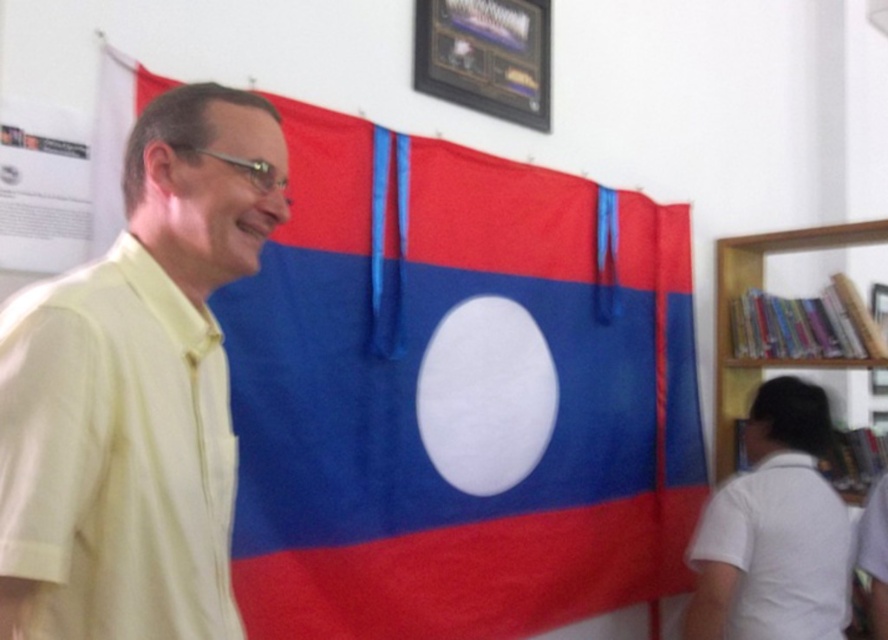
Question: Among these objects, which one is farthest from the camera?

Choices:
 (A) yellow cotton shirt at left
 (B) white matte shirt at lower right
 (C) wooden bookshelf at right
 (D) textured fabric flag at center

Answer: (C)

Question: Is yellow cotton shirt at left below metallic framed certificate at upper center?

Choices:
 (A) yes
 (B) no

Answer: (A)

Question: Can you confirm if yellow cotton shirt at left is positioned above white matte shirt at lower right?

Choices:
 (A) no
 (B) yes

Answer: (B)

Question: Which point is closer to the camera?

Choices:
 (A) (735, 476)
 (B) (437, 8)
 (C) (239, 208)
 (D) (722, 305)

Answer: (C)

Question: Which of the following is the farthest from the observer?

Choices:
 (A) textured fabric flag at center
 (B) yellow cotton shirt at left

Answer: (A)

Question: Does metallic framed certificate at upper center appear under wooden bookshelf at right?

Choices:
 (A) no
 (B) yes

Answer: (A)